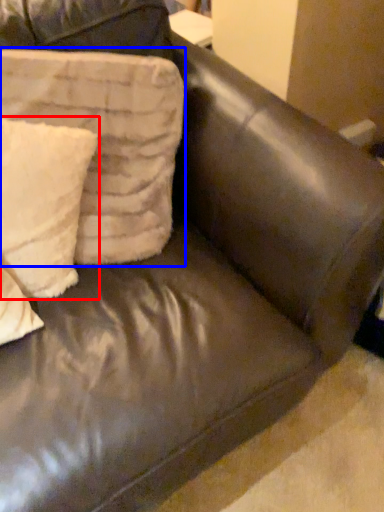
Question: Which object appears closest to the camera in this image, pillow (highlighted by a red box) or pillow (highlighted by a blue box)?

Choices:
 (A) pillow
 (B) pillow

Answer: (B)